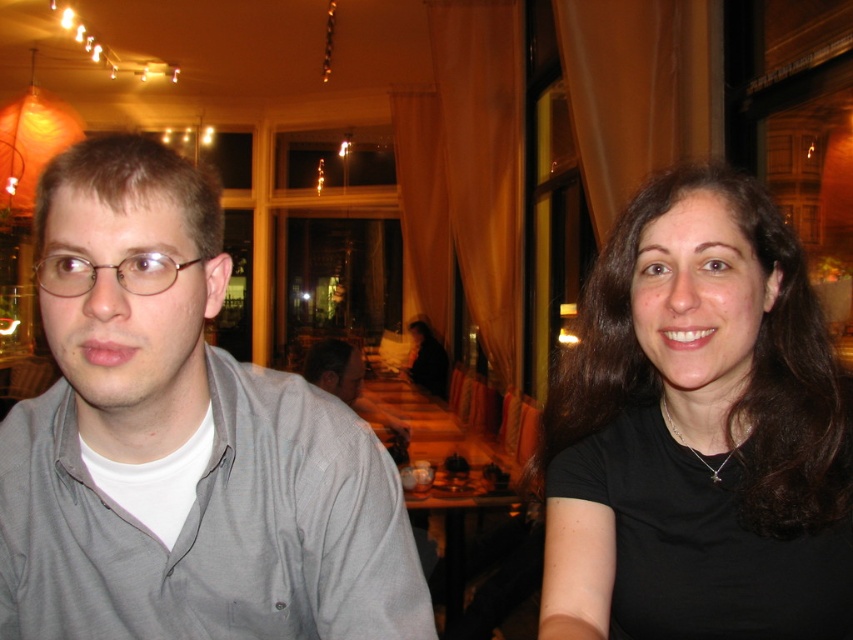
You are a delivery robot that needs to place a small package at point (142, 257) in the image. The package must be placed exactly at that point. However, the robot has a maximum reach of 65 centimeters. Can the robot successfully place the package at the specified point?

The distance of point (142, 257) from the camera is 66.37 centimeters. Since the robot can only reach up to 65 centimeters, it cannot place the package at that point as it is 1.37 centimeters beyond its reach.

Consider the image. You are a waiter in a restaurant and need to place a dessert menu on the table between the wooden table at center and the matte plastic glasses at left. Where should you place it?

The wooden table at center is positioned on the right side of matte plastic glasses at left, so you should place the dessert menu between them on the right side of the matte plastic glasses at left.